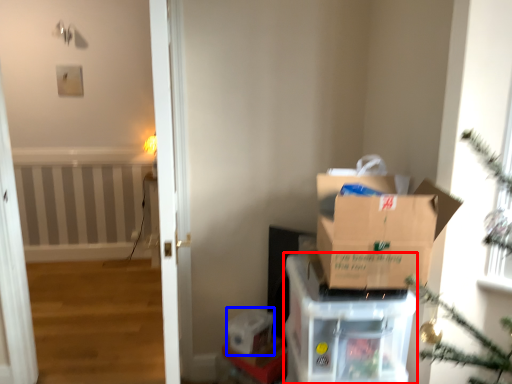
Question: Which object appears farthest to the camera in this image, cardboard box (highlighted by a red box) or storage box (highlighted by a blue box)?

Choices:
 (A) cardboard box
 (B) storage box

Answer: (B)